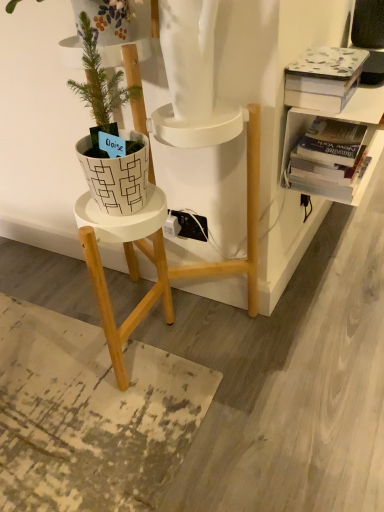
Identify the location of empty space that is ontop of hardcover book at upper right, placed as the first book when sorted from bottom to top (from a real-world perspective). The image size is (384, 512). (330, 131).